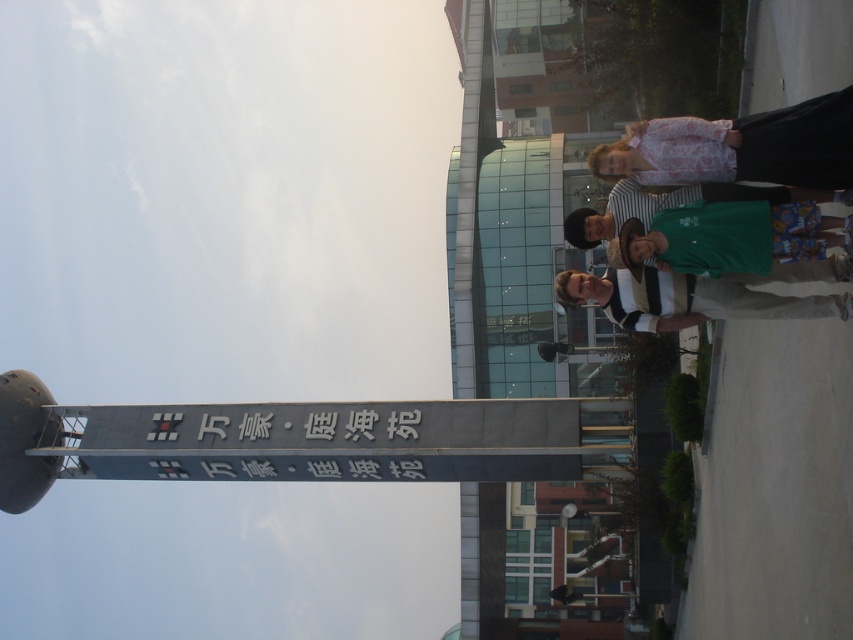
Question: Can you confirm if green cotton shirt at center is positioned to the left of green fabric shirt at right?

Choices:
 (A) yes
 (B) no

Answer: (A)

Question: Does green cotton shirt at center come behind green fabric shirt at right?

Choices:
 (A) no
 (B) yes

Answer: (A)

Question: Is pink floral shirt at upper right bigger than green fabric shirt at right?

Choices:
 (A) yes
 (B) no

Answer: (A)

Question: Estimate the real-world distances between objects in this image. Which object is farther from the green fabric shirt at center?

Choices:
 (A) green cotton shirt at center
 (B) green fabric shirt at right

Answer: (A)

Question: Which of the following is the closest to the observer?

Choices:
 (A) (647, 193)
 (B) (814, 172)

Answer: (B)

Question: Based on their relative distances, which object is nearer to the green fabric shirt at right?

Choices:
 (A) green fabric shirt at center
 (B) pink floral shirt at upper right
 (C) green cotton shirt at center

Answer: (B)